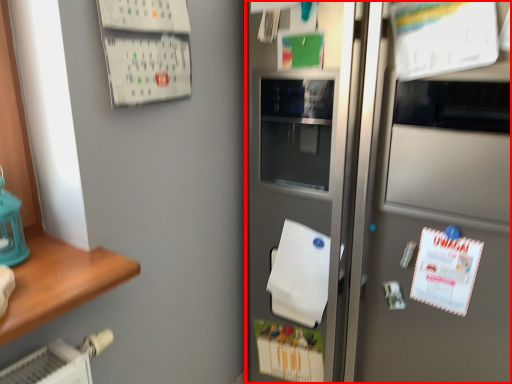
Question: From the image's perspective, what is the correct spatial relationship of refrigerator (annotated by the red box) in relation to wrapping paper?

Choices:
 (A) below
 (B) above

Answer: (B)